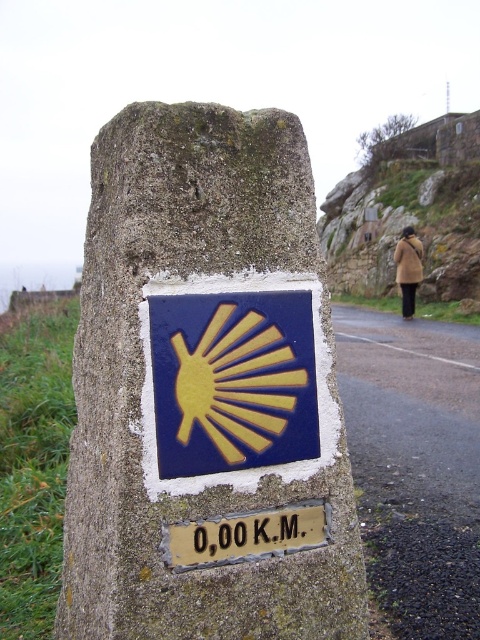
Question: Which object is closer to the camera taking this photo?

Choices:
 (A) black plastic sign at center
 (B) brown woolen coat at center-right
 (C) stone at center
 (D) goldmaterial/textureplaque at lower center

Answer: (C)

Question: Is stone at center thinner than goldmaterial/textureplaque at lower center?

Choices:
 (A) no
 (B) yes

Answer: (A)

Question: Is stone at center above brown woolen coat at center-right?

Choices:
 (A) no
 (B) yes

Answer: (A)

Question: Can you confirm if goldmaterial/textureplaque at lower center is thinner than black plastic sign at center?

Choices:
 (A) yes
 (B) no

Answer: (B)

Question: Which is nearer to the goldmaterial/textureplaque at lower center?

Choices:
 (A) stone at center
 (B) black plastic sign at center
 (C) brown woolen coat at center-right

Answer: (B)

Question: Which of the following is the closest to the observer?

Choices:
 (A) stone at center
 (B) brown woolen coat at center-right
 (C) black plastic sign at center
 (D) goldmaterial/textureplaque at lower center

Answer: (A)